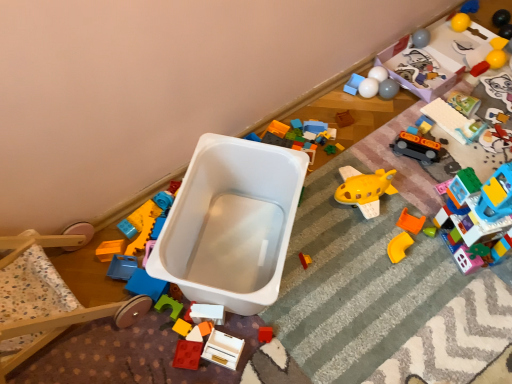
Locate an element on the screen. unoccupied region to the right of white glossy balls at upper right, the ninth toy positioned from the left is located at coordinates (416, 94).